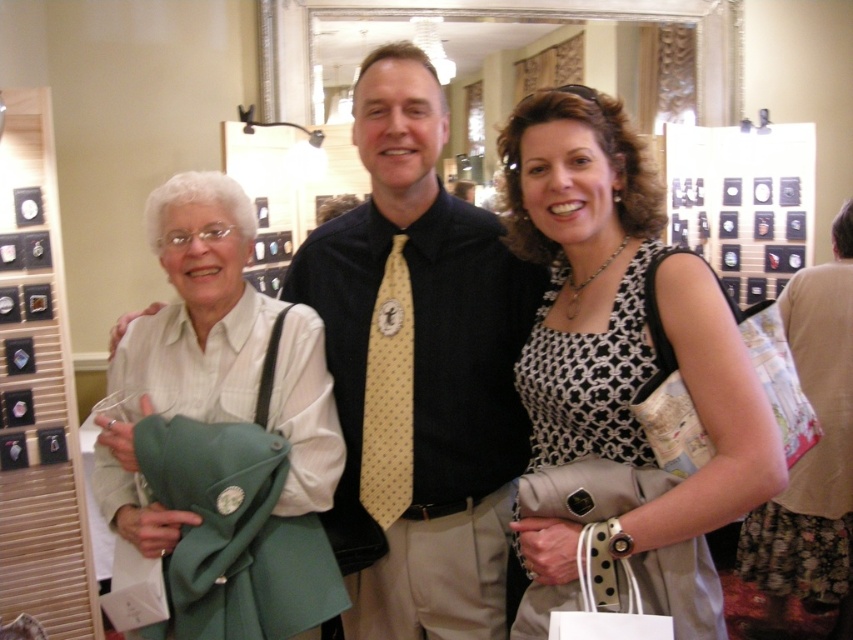
Does black and white dress at center appear under beige dotted tie at center?

Actually, black and white dress at center is above beige dotted tie at center.

Consider the image. Between black and white dress at center and beige dotted tie at center, which one is positioned lower?

beige dotted tie at center is below.

What are the coordinates of `black and white dress at center` in the screenshot? It's located at (624, 320).

The image size is (853, 640). What do you see at coordinates (624, 320) in the screenshot?
I see `black and white dress at center` at bounding box center [624, 320].

Find the location of a particular element. The height and width of the screenshot is (640, 853). black and white dress at center is located at coordinates (624, 320).

Is white cotton shirt at center to the left of beige dotted tie at center from the viewer's perspective?

Correct, you'll find white cotton shirt at center to the left of beige dotted tie at center.

Is point (207, 288) more distant than point (775, 588)?

No, (207, 288) is in front of (775, 588).

This screenshot has height=640, width=853. I want to click on white cotton shirt at center, so click(x=201, y=298).